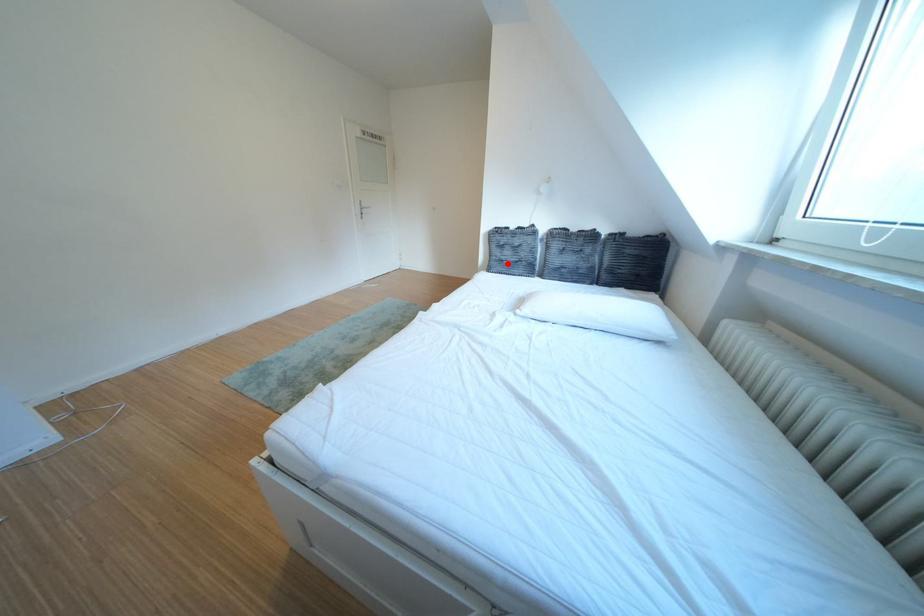
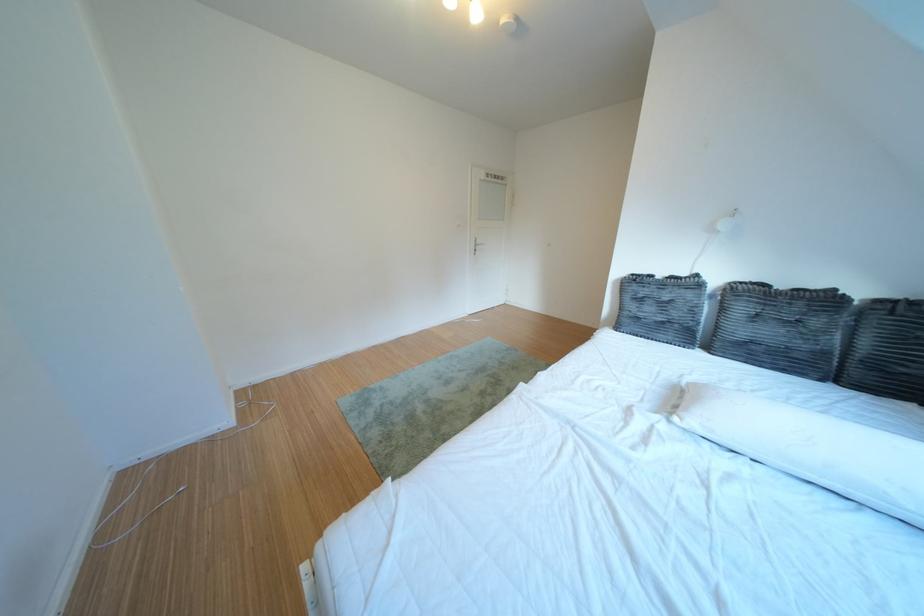
Question: I am providing you with two images of the same scene from different viewpoints. A red point is marked on the first image. At the location where the point appears in image 1, is it still visible in image 2?

Choices:
 (A) Yes
 (B) No

Answer: (A)